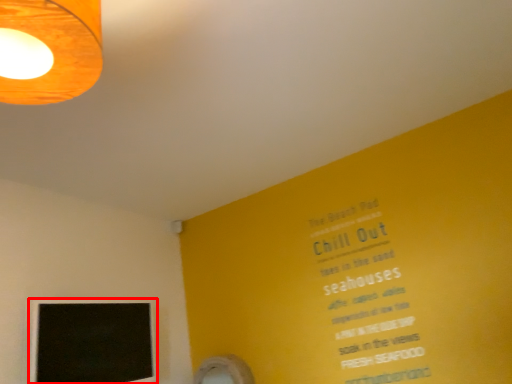
Question: Where is computer monitor (annotated by the red box) located in relation to lamp in the image?

Choices:
 (A) right
 (B) left

Answer: (B)